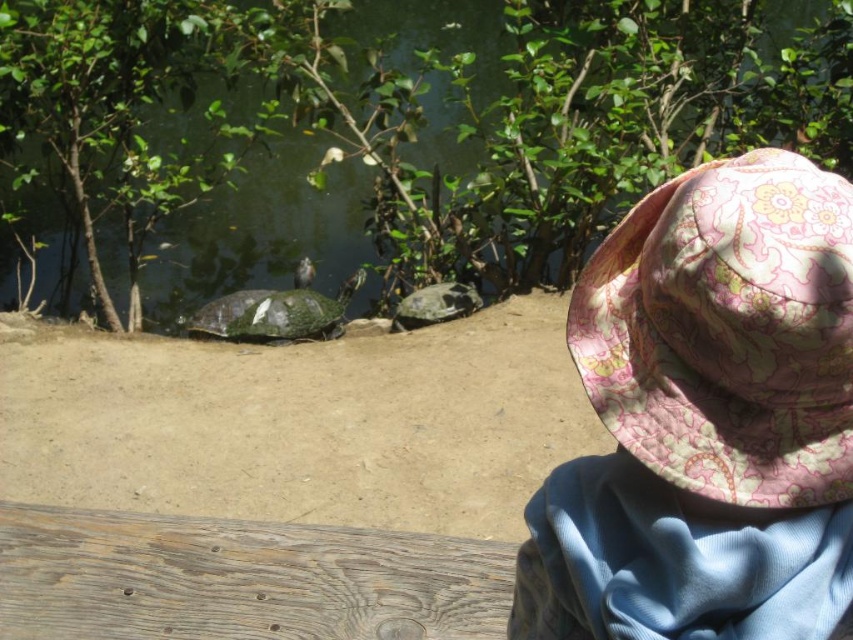
You are a nature photographer aiming to capture both the green scaly tortoise at center and the green textured tortoise at center in a single frame. Which tortoise should you adjust your camera focus to first if you want to include both in your shot?

The green scaly tortoise at center is positioned on the left side of green textured tortoise at center, so you should focus on the green textured tortoise at center first since it is closer to the foreground compared to the green scaly tortoise at center.